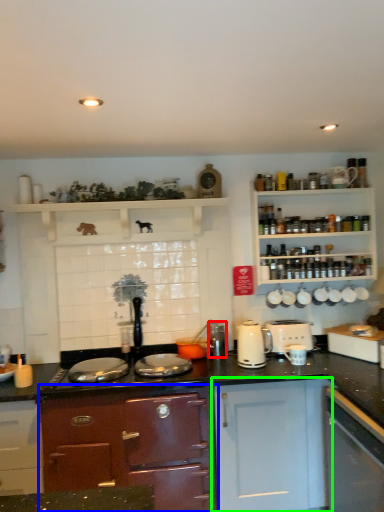
Question: Which object is positioned farthest from appliance (highlighted by a red box)? Select from cabinetry (highlighted by a blue box) and cabinetry (highlighted by a green box).

Choices:
 (A) cabinetry
 (B) cabinetry

Answer: (A)